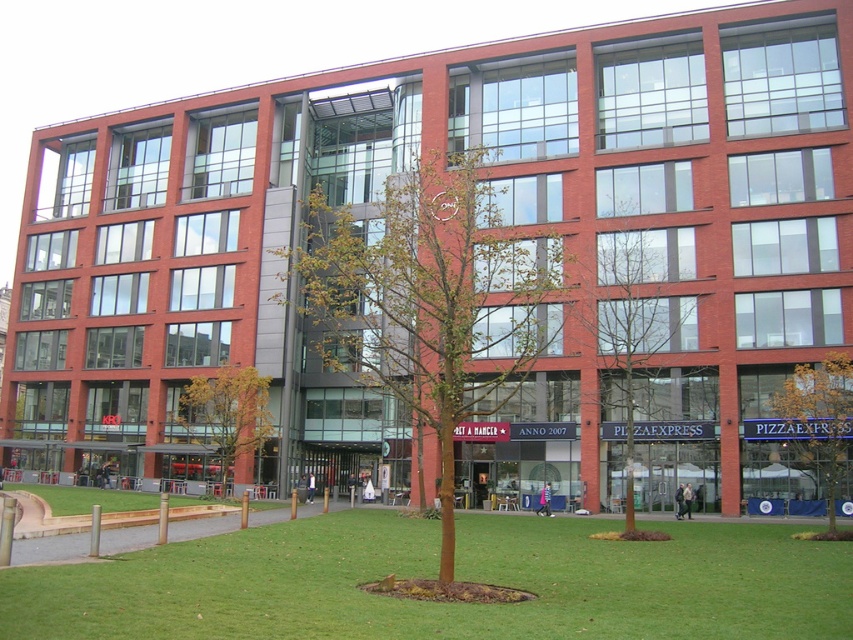
Question: Does green grass at center have a lesser width compared to green leafy tree at center?

Choices:
 (A) no
 (B) yes

Answer: (A)

Question: Considering the real-world distances, which object is closest to the green grass at center?

Choices:
 (A) green leafy tree at lower right
 (B) green leafy tree at center
 (C) yellow-green leaves at center
 (D) bare branches at center

Answer: (A)

Question: Considering the relative positions of green grass at center and green leafy tree at center in the image provided, where is green grass at center located with respect to green leafy tree at center?

Choices:
 (A) above
 (B) below

Answer: (B)

Question: Is green grass at center to the left of bare branches at center from the viewer's perspective?

Choices:
 (A) no
 (B) yes

Answer: (B)

Question: Which object is closer to the camera taking this photo?

Choices:
 (A) bare branches at center
 (B) green leafy tree at center
 (C) green grass at center

Answer: (C)

Question: Which object is the farthest from the green leafy tree at lower right?

Choices:
 (A) green leafy tree at center
 (B) green grass at center
 (C) yellow-green leaves at center

Answer: (C)